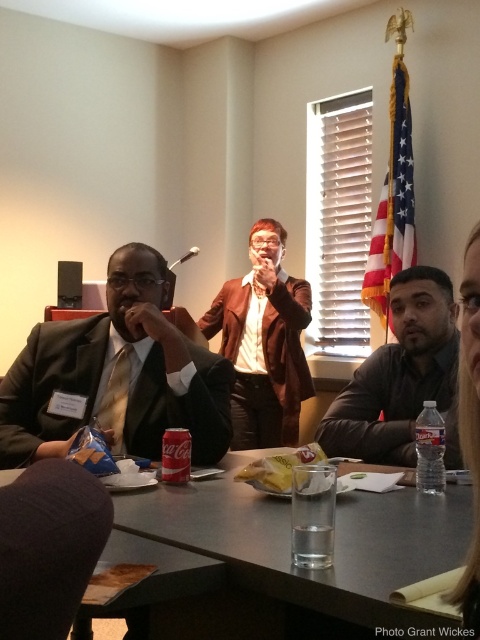
You are standing in the room and want to reach the point at coordinates (x=368, y=413). The table is 2 meters long. Can you walk directly to that point without moving any objects?

The point at coordinates (x=368, y=413) is 2.21 meters away from the viewer. Since the table is only 2 meters long, you would need to move around the table or move some objects to reach it directly.

You are organizing a formal event and need to place a large coat rack in the room. Given the sizes of the matte black suit at left and brown leather jacket at center, which item would require a larger coat rack?

The brown leather jacket at center requires a larger coat rack since it is bigger than the matte black suit at left.

You are standing in the room and want to find the matte black suit at left. Where should you look based on the coordinates provided?

The matte black suit at left is located at coordinates point [118,374].